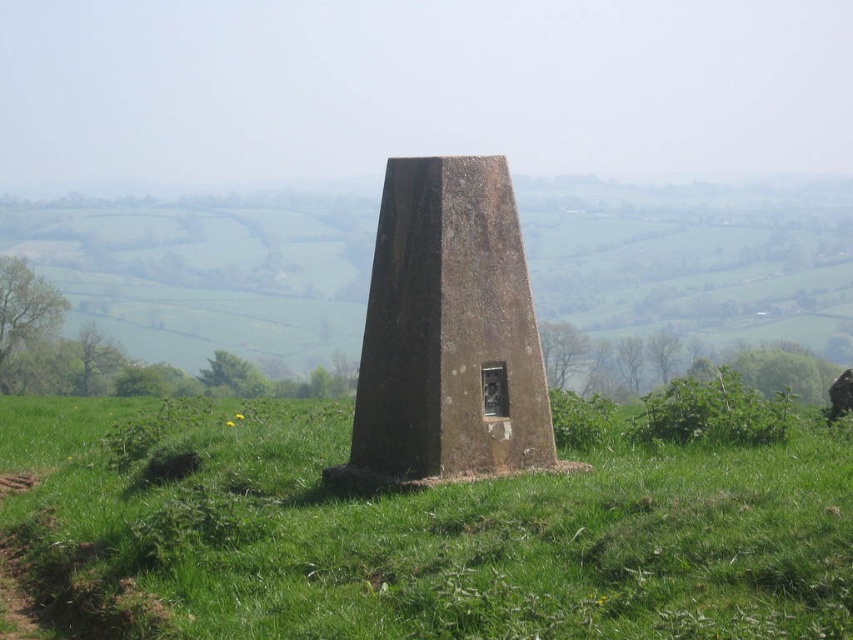
Question: Can you confirm if green grassy at center is positioned below brown stone monument at center?

Choices:
 (A) yes
 (B) no

Answer: (A)

Question: Can you confirm if green grassy at center is positioned above brown stone monument at center?

Choices:
 (A) no
 (B) yes

Answer: (A)

Question: Does green grassy at center have a greater width compared to brown stone monument at center?

Choices:
 (A) yes
 (B) no

Answer: (A)

Question: Which point is farther to the camera?

Choices:
 (A) (482, 243)
 (B) (563, 618)

Answer: (A)